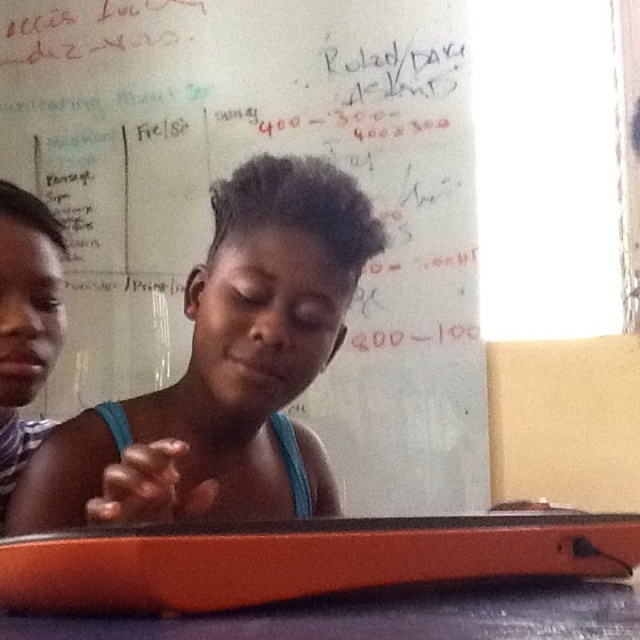
Can you confirm if whiteboard at upper center is positioned to the right of striped fabric shirt at left?

Yes, whiteboard at upper center is to the right of striped fabric shirt at left.

Is whiteboard at upper center wider than striped fabric shirt at left?

Yes.

Locate an element on the screen. This screenshot has width=640, height=640. whiteboard at upper center is located at coordinates (230, 168).

Can you confirm if whiteboard at upper center is bigger than blue glossy table at lower center?

Yes.

Is point (378, 291) positioned before point (278, 612)?

No, it is not.

Is point (128, 188) less distant than point (292, 612)?

No.

The width and height of the screenshot is (640, 640). In order to click on whiteboard at upper center in this screenshot , I will do `click(230, 168)`.

From the picture: Can you confirm if whiteboard at upper center is smaller than orange plastic tray at lower center?

No, whiteboard at upper center is not smaller than orange plastic tray at lower center.

I want to click on whiteboard at upper center, so click(230, 168).

Find the location of a particular element. whiteboard at upper center is located at coordinates (230, 168).